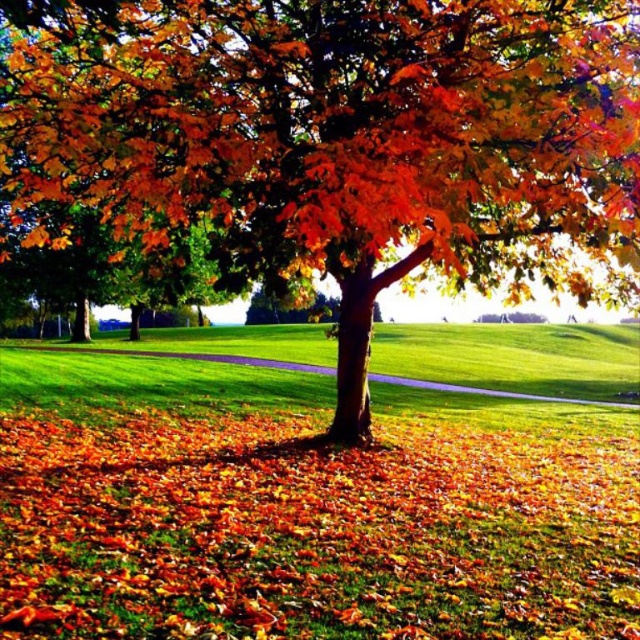
Question: Which object is closer to the camera taking this photo?

Choices:
 (A) green grass at center
 (B) shiny orange leaves at center

Answer: (B)

Question: Does shiny orange leaves at center appear over green grass at center?

Choices:
 (A) no
 (B) yes

Answer: (B)

Question: Does shiny orange leaves at center have a greater width compared to green grass at center?

Choices:
 (A) no
 (B) yes

Answer: (A)

Question: Is shiny orange leaves at center closer to the viewer compared to green grass at center?

Choices:
 (A) yes
 (B) no

Answer: (A)